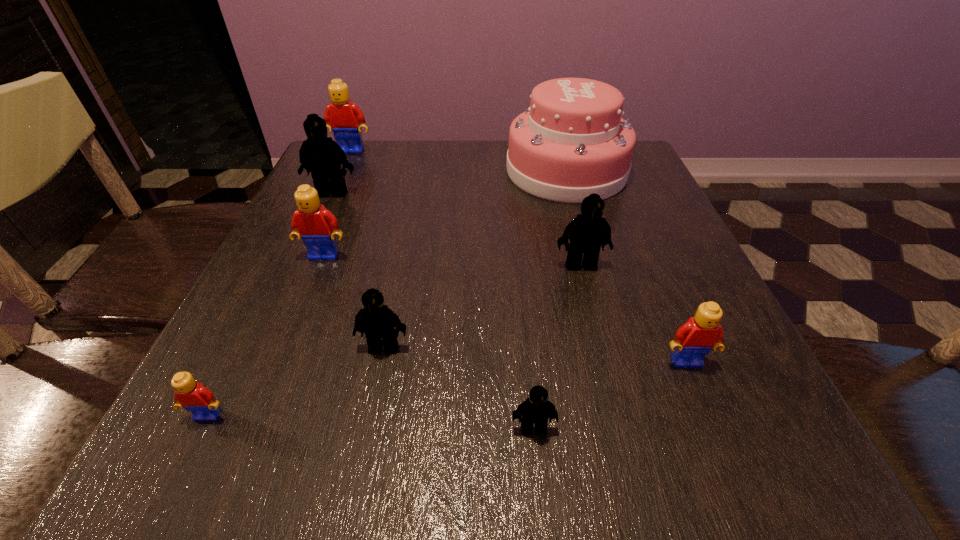
Locate an element on the screen. The height and width of the screenshot is (540, 960). free space located on the face of the fifth object from left to right is located at coordinates (363, 451).

Where is `vacant space situated on the front-facing side of the third farthest yellow Lego`? vacant space situated on the front-facing side of the third farthest yellow Lego is located at coordinates (710, 419).

You are a GUI agent. You are given a task and a screenshot of the screen. Output one action in this format:
    pyautogui.click(x=<x>, y=<y>)
    Task: Click on the vacant area situated on the front-facing side of the smallest yellow Lego
    
    Given the screenshot: What is the action you would take?
    pos(179,476)

Locate an element on the screen. The width and height of the screenshot is (960, 540). cake present at the far edge is located at coordinates (571, 142).

At what (x,y) coordinates should I click in order to perform the action: click on cake that is at the right edge. Please return your answer as a coordinate pair (x, y). Looking at the image, I should click on (571, 142).

Identify the location of Lego that is at the right edge. (693, 340).

Where is `object that is at the near left corner`? This screenshot has width=960, height=540. object that is at the near left corner is located at coordinates (193, 396).

Identify the location of object that is at the far right corner. (571, 142).

In the image, there is a desktop. Identify the location of free space at the far edge. (472, 156).

In the image, there is a desktop. Where is `vacant space at the left edge`? vacant space at the left edge is located at coordinates (297, 251).